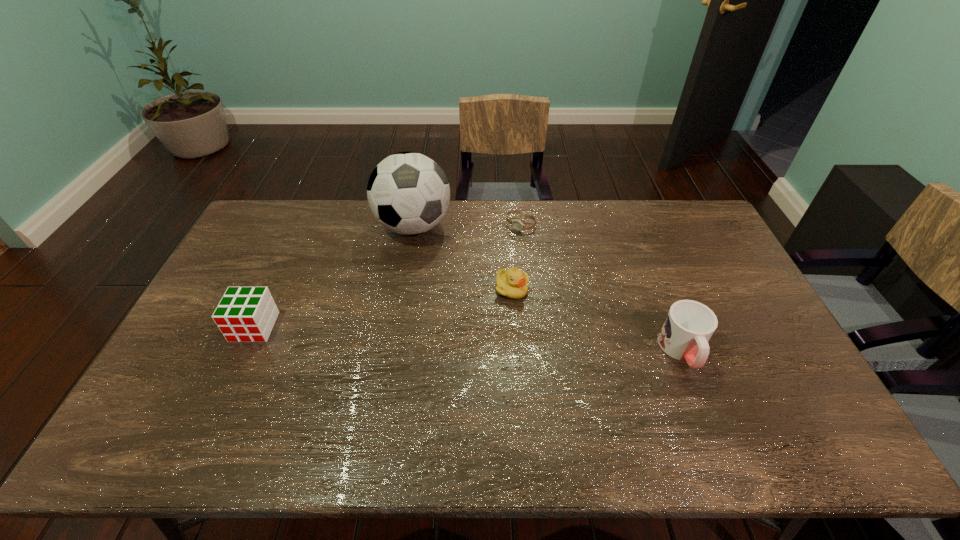
What are the coordinates of `vacant space on the desktop that is between the leftmost object and the mug and is positioned on the face of the shortest object` in the screenshot? It's located at (412, 336).

You are a GUI agent. You are given a task and a screenshot of the screen. Output one action in this format:
    pyautogui.click(x=<x>, y=<y>)
    Task: Click on the free spot on the desktop that is between the cube and the rightmost object and is positioned on the beak of the duckling
    The height and width of the screenshot is (540, 960).
    Given the screenshot: What is the action you would take?
    pyautogui.click(x=526, y=342)

Locate an element on the screen. This screenshot has width=960, height=540. vacant spot on the desktop that is between the leftmost object and the rightmost object and is positioned on the main logo of the fourth object from right to left is located at coordinates (421, 336).